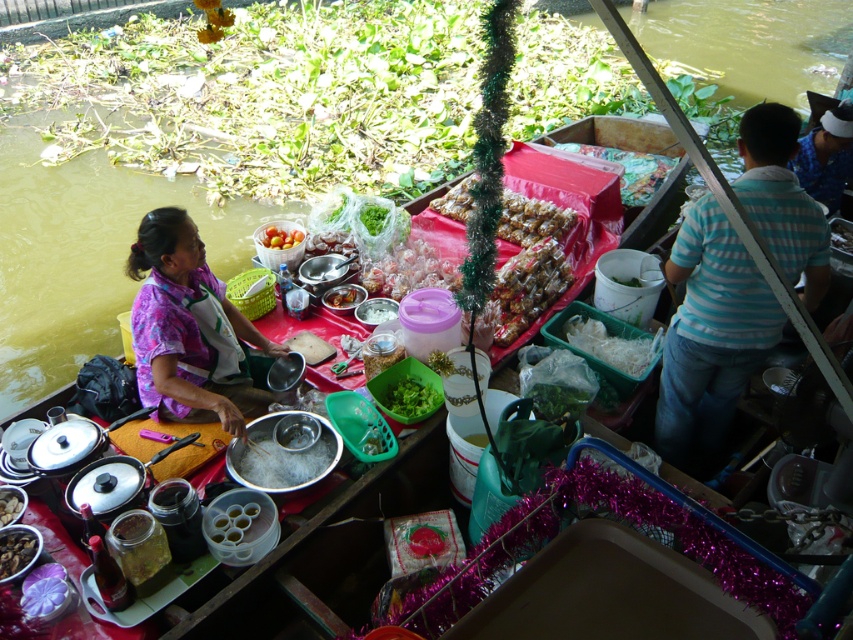
Which is more to the left, translucent plastic wrapped candies at center or brown matte nuts at lower left?

brown matte nuts at lower left

The image size is (853, 640). Find the location of `translucent plastic wrapped candies at center`. translucent plastic wrapped candies at center is located at coordinates click(x=410, y=269).

Between point (294, 474) and point (15, 492), which one is positioned in front?

Positioned in front is point (15, 492).

Does point (308, 464) come behind point (4, 490)?

Yes, point (308, 464) is behind point (4, 490).

This screenshot has width=853, height=640. I want to click on shiny silver bowl at center, so click(283, 461).

Measure the distance from purple floral shirt at center to shiny silver bowl at center.

purple floral shirt at center and shiny silver bowl at center are 41.23 centimeters apart from each other.

Does purple floral shirt at center have a smaller size compared to shiny silver bowl at center?

No, purple floral shirt at center is not smaller than shiny silver bowl at center.

Between point (183, 227) and point (276, 460), which one is positioned behind?

Point (276, 460)

You are a GUI agent. You are given a task and a screenshot of the screen. Output one action in this format:
    pyautogui.click(x=<x>, y=<y>)
    Task: Click on the purple floral shirt at center
    This screenshot has height=640, width=853.
    Given the screenshot: What is the action you would take?
    pyautogui.click(x=189, y=330)